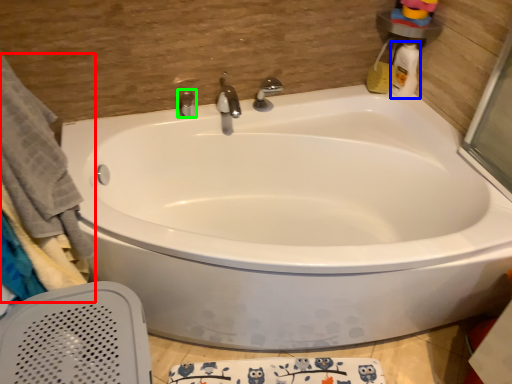
Question: Which is farther away from bath towel (highlighted by a red box)? cleaning product (highlighted by a blue box) or tap (highlighted by a green box)?

Choices:
 (A) cleaning product
 (B) tap

Answer: (A)